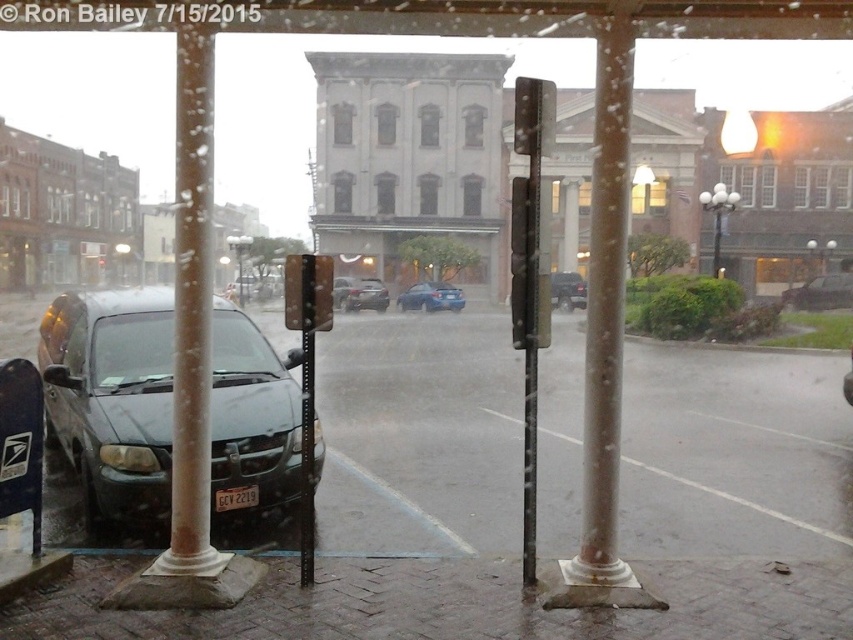
You are standing inside a building looking out through a window with raindrops. You notice a dark sedan parked near the curb and a point marked at coordinates (120, 262). What object is located at that point?

The point at coordinates (120, 262) corresponds to the matte black lamp post at upper center.

You are standing inside a building and looking through a window with raindrops. You notice a white marble pole at left. Can you determine its exact position on the window using coordinates?

The white marble pole at left is located at point (x=190, y=316), so its exact position on the window can be determined using these coordinates.